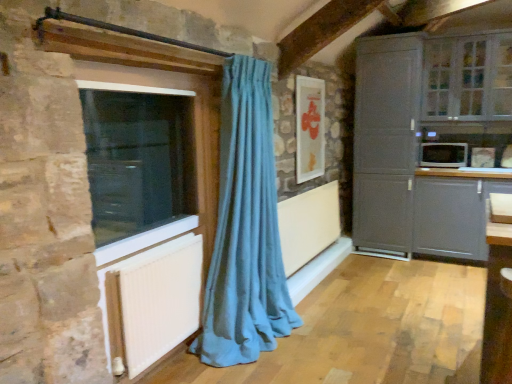
Find the location of a particular element. white glossy microwave at right is located at coordinates point(443,155).

From the picture: Measure the distance between point (x=440, y=224) and camera.

Point (x=440, y=224) is 4.17 meters from camera.

Identify the location of clear glass cabinet at upper right, which appears as the first window when viewed from the right. Image resolution: width=512 pixels, height=384 pixels. (468, 77).

Which of these two, matte gray cabinet at right or white glossy microwave at right, is wider?

Wider between the two is matte gray cabinet at right.

You are a GUI agent. You are given a task and a screenshot of the screen. Output one action in this format:
    pyautogui.click(x=<x>, y=<y>)
    Task: Click on the appliance below the matte gray cabinet at right (from the image's perspective)
    This screenshot has height=384, width=512.
    Given the screenshot: What is the action you would take?
    pyautogui.click(x=443, y=155)

Does matte gray cabinet at right have a lesser height compared to white glossy microwave at right?

No, matte gray cabinet at right is not shorter than white glossy microwave at right.

Is white glossy microwave at right at the back of matte gray cabinet at lower right?

No, white glossy microwave at right is not at the back of matte gray cabinet at lower right.

From a real-world perspective, which is physically above, matte gray cabinet at lower right or white glossy microwave at right?

white glossy microwave at right.

Between matte gray cabinet at lower right and white glossy microwave at right, which one has smaller width?

white glossy microwave at right.

In the scene shown: From a real-world perspective, is matte gray cabinet at right physically above clear glass cabinet at upper right, marked as the second window in a front-to-back arrangement?

No, from a real-world perspective, matte gray cabinet at right is not over clear glass cabinet at upper right, marked as the second window in a front-to-back arrangement

Is matte gray cabinet at right far away from clear glass cabinet at upper right, arranged as the second window when ordered from the bottom?

No.

Can you confirm if matte gray cabinet at right is positioned to the right of clear glass cabinet at upper right, arranged as the second window when ordered from the bottom?

In fact, matte gray cabinet at right is to the left of clear glass cabinet at upper right, arranged as the second window when ordered from the bottom.

Could you tell me if matte gray cabinet at right is facing clear glass cabinet at upper right, placed as the first window when sorted from back to front?

No, matte gray cabinet at right does not turn towards clear glass cabinet at upper right, placed as the first window when sorted from back to front.

Is white textured radiator at lower left positioned with its back to clear glass cabinet at upper right, the first window in the top-to-bottom sequence?

white textured radiator at lower left is not turned away from clear glass cabinet at upper right, the first window in the top-to-bottom sequence.

Does white textured radiator at lower left appear on the left side of clear glass cabinet at upper right, placed as the first window when sorted from back to front?

Indeed, white textured radiator at lower left is positioned on the left side of clear glass cabinet at upper right, placed as the first window when sorted from back to front.

Is white textured radiator at lower left positioned far away from clear glass cabinet at upper right, marked as the second window in a front-to-back arrangement?

Yes, white textured radiator at lower left and clear glass cabinet at upper right, marked as the second window in a front-to-back arrangement, are located far from each other.

Looking at the image, does white textured radiator at lower left seem bigger or smaller compared to clear glass cabinet at upper right, the first window in the top-to-bottom sequence?

In the image, white textured radiator at lower left appears to be smaller than clear glass cabinet at upper right, the first window in the top-to-bottom sequence.

Find the location of `radiator on the left side of matte gray cabinet at right`. radiator on the left side of matte gray cabinet at right is located at coordinates (151, 302).

Consider the image. Is white textured radiator at lower left not near matte gray cabinet at right?

Yes, white textured radiator at lower left is far from matte gray cabinet at right.

Could matte gray cabinet at right be considered to be inside white textured radiator at lower left?

No, matte gray cabinet at right is not inside white textured radiator at lower left.

Is clear glass cabinet at upper right, marked as the second window in a front-to-back arrangement, directly adjacent to matte gray cabinet at lower right?

No, clear glass cabinet at upper right, marked as the second window in a front-to-back arrangement, is not with matte gray cabinet at lower right.

From the image's perspective, who appears lower, clear glass cabinet at upper right, the first window in the top-to-bottom sequence, or matte gray cabinet at lower right?

From the image's view, matte gray cabinet at lower right is below.

Considering the positions of point (454, 59) and point (472, 190), is point (454, 59) closer or farther from the camera than point (472, 190)?

Point (454, 59) appears to be farther away from the viewer than point (472, 190).

Is clear glass cabinet at upper right, placed as the first window when sorted from back to front, to the left or to the right of matte gray cabinet at lower right in the image?

clear glass cabinet at upper right, placed as the first window when sorted from back to front, is positioned on matte gray cabinet at lower right's right side.

Is white glossy microwave at right looking in the opposite direction of white textured radiator at lower left?

No, white glossy microwave at right is not facing the opposite direction of white textured radiator at lower left.

Are white glossy microwave at right and white textured radiator at lower left far apart?

Indeed, white glossy microwave at right is not near white textured radiator at lower left.

Which of these two, white glossy microwave at right or white textured radiator at lower left, is smaller?

Smaller between the two is white textured radiator at lower left.

Where is `radiator that appears below the white glossy microwave at right (from the image's perspective)`? radiator that appears below the white glossy microwave at right (from the image's perspective) is located at coordinates (151, 302).

At what (x,y) coordinates should I click in order to perform the action: click on screen door lying in front of the white glossy microwave at right. Please return your answer as a coordinate pair (x, y). The image size is (512, 384). Looking at the image, I should click on (385, 140).

There is a matte gray cabinet at lower right. Where is `appliance above it (from a real-world perspective)`? The width and height of the screenshot is (512, 384). appliance above it (from a real-world perspective) is located at coordinates coord(443,155).

Consider the image. When comparing their distances from white glossy microwave at right, does transparent glass window at left, positioned as the first window in left-to-right order, or clear glass cabinet at upper right, which is the second window from left to right, seem further?

transparent glass window at left, positioned as the first window in left-to-right order, is positioned further to the anchor white glossy microwave at right.

When comparing their distances from matte gray cabinet at lower right, does white glossy microwave at right or clear glass cabinet at upper right, which appears as the first window when viewed from the right, seem closer?

Based on the image, white glossy microwave at right appears to be nearer to matte gray cabinet at lower right.

Estimate the real-world distances between objects in this image. Which object is closer to matte gray cabinet at right, white glossy microwave at right or white textured radiator at lower left?

white glossy microwave at right is closer to matte gray cabinet at right.

Considering their positions, is teal fabric curtain at left positioned further to matte gray cabinet at lower right than white glossy microwave at right?

The object further to matte gray cabinet at lower right is teal fabric curtain at left.

Based on their spatial positions, is white textured radiator at lower left or teal fabric curtain at left further from white glossy microwave at right?

Among the two, white textured radiator at lower left is located further to white glossy microwave at right.

Based on their spatial positions, is white textured radiator at lower left or white glossy microwave at right closer to matte gray cabinet at right?

The object closer to matte gray cabinet at right is white glossy microwave at right.

Based on their spatial positions, is matte gray cabinet at right or transparent glass window at left, positioned as the first window in front-to-back order, closer to matte gray cabinet at lower right?

matte gray cabinet at right is closer to matte gray cabinet at lower right.

Which object lies nearer to the anchor point matte gray cabinet at lower right, transparent glass window at left, positioned as the first window in left-to-right order, or white glossy microwave at right?

Based on the image, white glossy microwave at right appears to be nearer to matte gray cabinet at lower right.

Where is `screen door situated between white textured radiator at lower left and clear glass cabinet at upper right, placed as the first window when sorted from back to front, from left to right`? screen door situated between white textured radiator at lower left and clear glass cabinet at upper right, placed as the first window when sorted from back to front, from left to right is located at coordinates (385, 140).

This screenshot has width=512, height=384. I want to click on screen door between clear glass cabinet at upper right, which appears as the first window when viewed from the right, and white glossy microwave at right vertically, so [385, 140].

I want to click on curtain located between white textured radiator at lower left and clear glass cabinet at upper right, the first window in the top-to-bottom sequence, in the left-right direction, so click(x=245, y=229).

At what (x,y) coordinates should I click in order to perform the action: click on radiator between transparent glass window at left, which is the 2th window from back to front, and matte gray cabinet at right in the front-back direction. Please return your answer as a coordinate pair (x, y). Looking at the image, I should click on (151, 302).